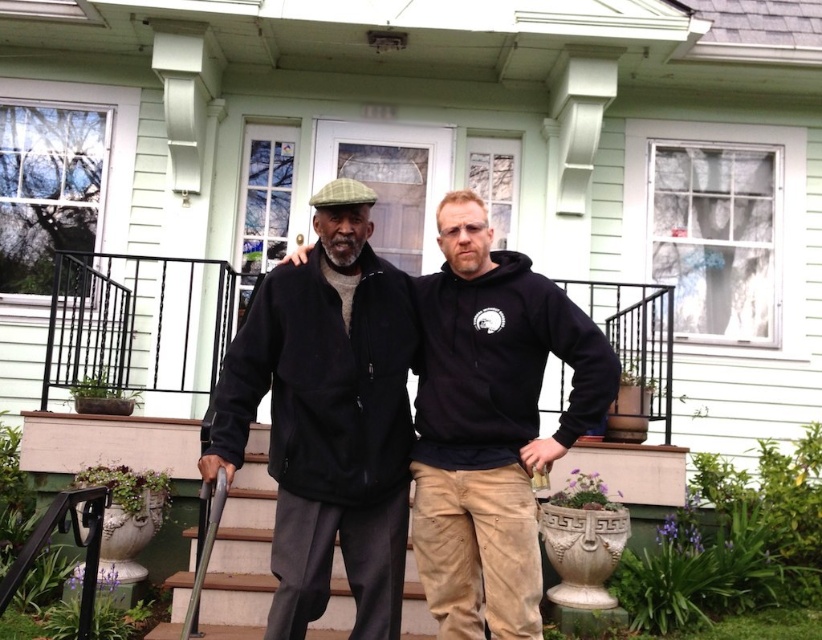
You are a delivery person trying to reach the front door of the light green house. You see the white painted wood porch at center and the black fleece hoodie at center. Which object is closer to the front door?

The white painted wood porch at center is closer to the front door because it is to the left of the black fleece hoodie at center, and the front door is on the porch.